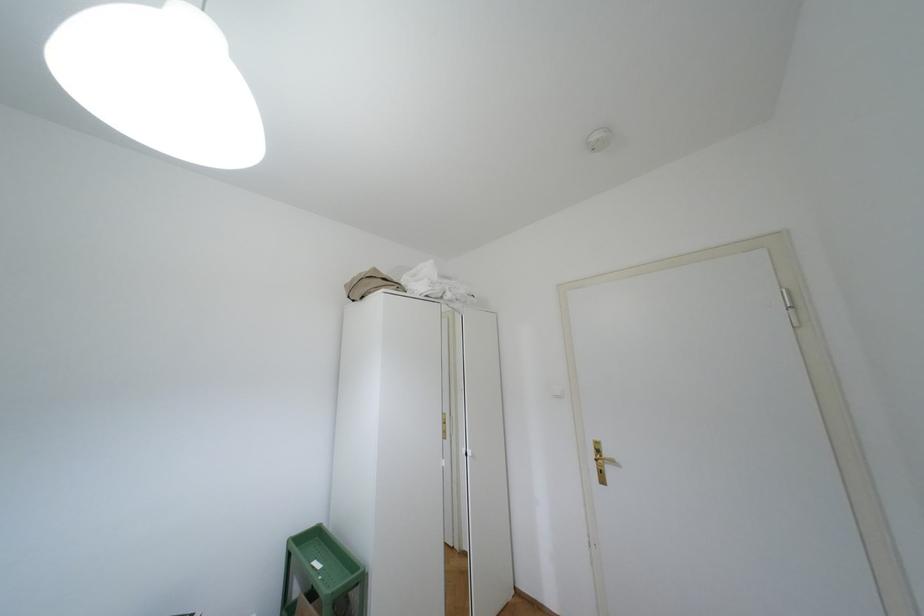
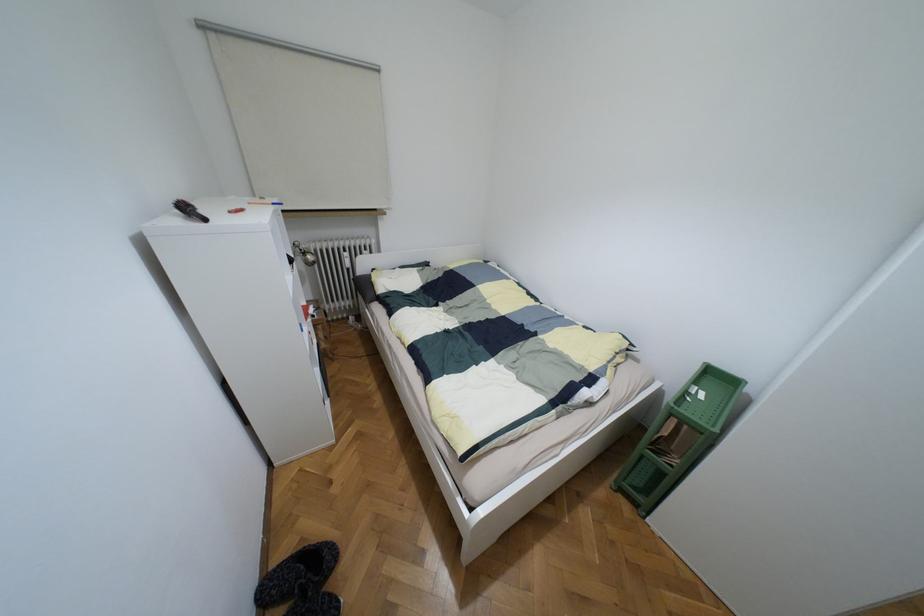
Based on the continuous images, in which direction is the camera rotating?

The rotation direction of the camera is left-down.